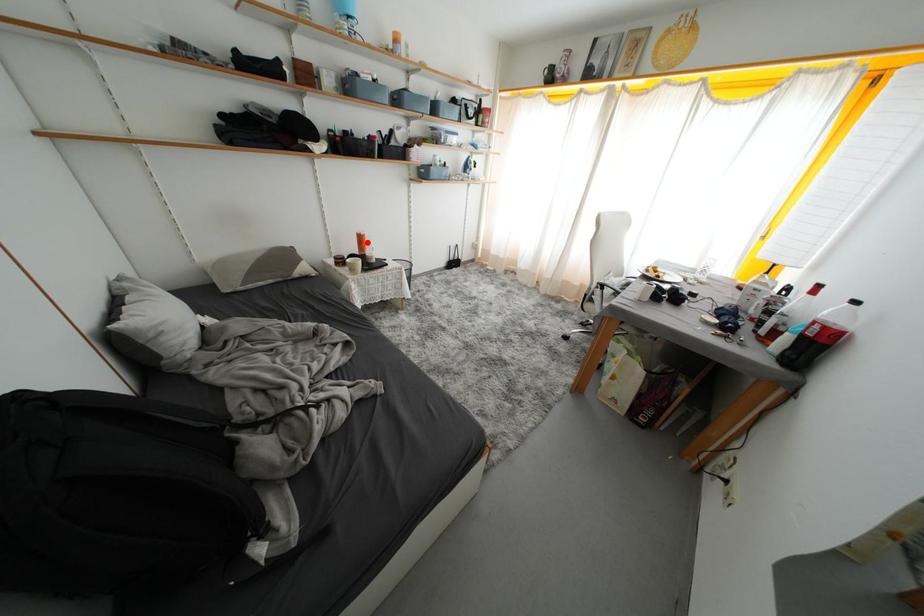
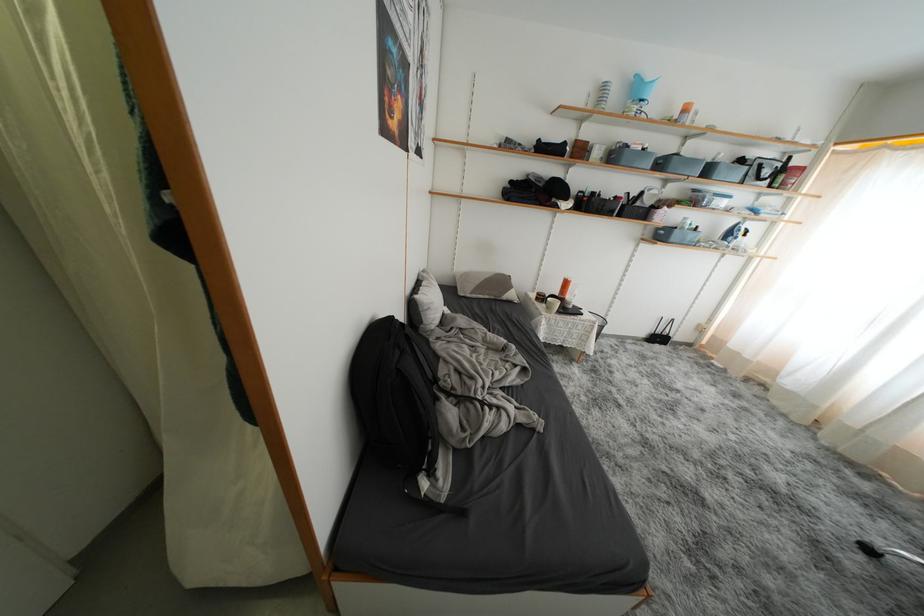
The point at the highlighted location is marked in the first image. Where is the corresponding point in the second image?

(572, 286)